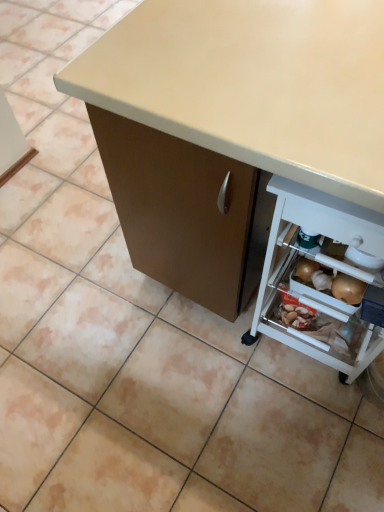
Question: From a real-world perspective, is matte beige desk at center above or below white plastic shelf at lower right?

Choices:
 (A) above
 (B) below

Answer: (A)

Question: Is point (193, 22) closer or farther from the camera than point (372, 304)?

Choices:
 (A) closer
 (B) farther

Answer: (A)

Question: In the image, is matte beige desk at center positioned in front of or behind white plastic shelf at lower right?

Choices:
 (A) front
 (B) behind

Answer: (A)

Question: Considering the positions of white plastic shelf at lower right and matte beige desk at center in the image, is white plastic shelf at lower right taller or shorter than matte beige desk at center?

Choices:
 (A) short
 (B) tall

Answer: (A)

Question: Does point (319, 198) appear closer or farther from the camera than point (258, 81)?

Choices:
 (A) closer
 (B) farther

Answer: (A)

Question: From a real-world perspective, is white plastic shelf at lower right positioned above or below matte beige desk at center?

Choices:
 (A) above
 (B) below

Answer: (B)

Question: In terms of size, does white plastic shelf at lower right appear bigger or smaller than matte beige desk at center?

Choices:
 (A) small
 (B) big

Answer: (A)